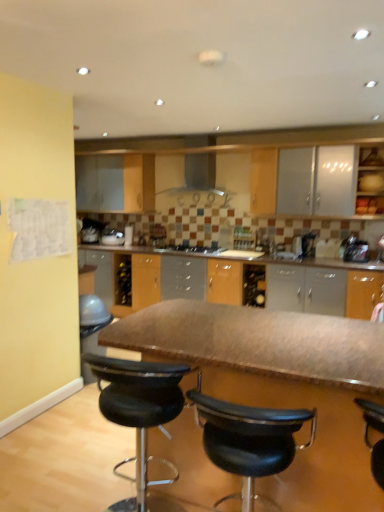
Question: Can you confirm if satin black kettle at right, acting as the 1th appliance starting from the front, is shorter than black leather stool at center, the 2th chair in the left-to-right sequence?

Choices:
 (A) no
 (B) yes

Answer: (B)

Question: From a real-world perspective, does satin black kettle at right, acting as the 1th appliance starting from the front, stand above black leather stool at center, which appears as the first chair when viewed from the right?

Choices:
 (A) no
 (B) yes

Answer: (B)

Question: From a real-world perspective, is satin black kettle at right, acting as the 1th appliance starting from the front, under black leather stool at center, the 2th chair in the left-to-right sequence?

Choices:
 (A) no
 (B) yes

Answer: (A)

Question: Can you confirm if satin black kettle at right, which is the second appliance from back to front, is bigger than black leather stool at center, the 2th chair in the left-to-right sequence?

Choices:
 (A) no
 (B) yes

Answer: (A)

Question: Can you confirm if satin black kettle at right, the second appliance in the left-to-right sequence, is taller than black leather stool at center, the 2th chair in the left-to-right sequence?

Choices:
 (A) yes
 (B) no

Answer: (B)

Question: Does satin black kettle at right, acting as the 1th appliance starting from the front, turn towards black leather stool at center, which appears as the first chair when viewed from the right?

Choices:
 (A) yes
 (B) no

Answer: (A)

Question: Does black leather stool at center, positioned as the second chair in right-to-left order, have a smaller size compared to matte wood cabinet at upper right?

Choices:
 (A) no
 (B) yes

Answer: (A)

Question: Is black leather stool at center, positioned as the second chair in right-to-left order, not near matte wood cabinet at upper right?

Choices:
 (A) no
 (B) yes

Answer: (B)

Question: Does black leather stool at center, positioned as the second chair in right-to-left order, appear on the right side of matte wood cabinet at upper right?

Choices:
 (A) no
 (B) yes

Answer: (A)

Question: Does black leather stool at center, positioned as the second chair in right-to-left order, have a lesser width compared to matte wood cabinet at upper right?

Choices:
 (A) yes
 (B) no

Answer: (B)

Question: Could you tell me if black leather stool at center, which is the first chair in left-to-right order, is turned towards matte wood cabinet at upper right?

Choices:
 (A) no
 (B) yes

Answer: (B)

Question: Is black leather stool at center, which is the first chair in left-to-right order, not within matte wood cabinet at upper right?

Choices:
 (A) no
 (B) yes

Answer: (B)

Question: Is black leather stool at center, positioned as the second chair in right-to-left order, smaller than smooth brown table at center?

Choices:
 (A) no
 (B) yes

Answer: (B)